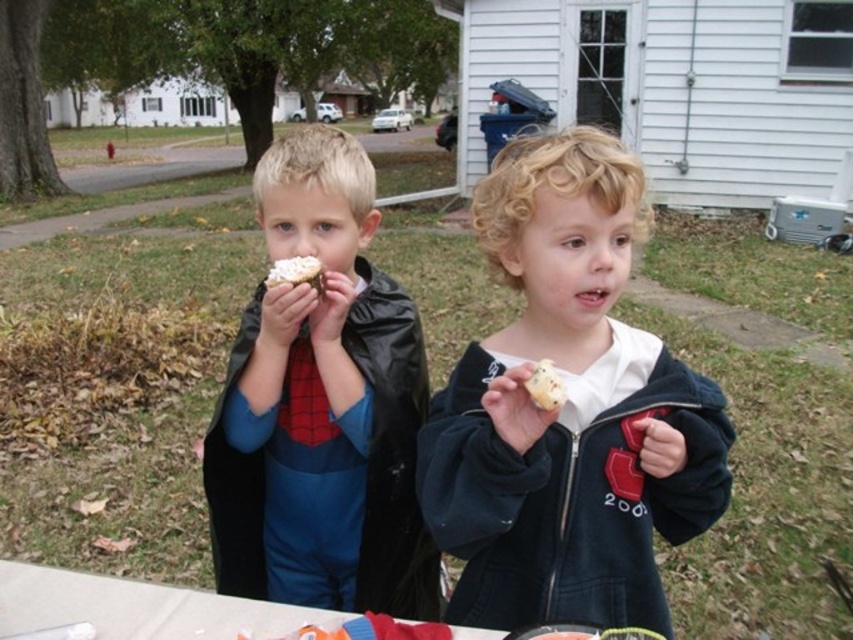
Question: Does white fluffy cake at center have a larger size compared to white fluffy cupcake at center?

Choices:
 (A) yes
 (B) no

Answer: (A)

Question: Which point is farther to the camera?

Choices:
 (A) white plastic table at lower center
 (B) matte black jacket at center

Answer: (A)

Question: Which object appears closest to the camera in this image?

Choices:
 (A) matte black cape at left
 (B) matte black jacket at center
 (C) white plastic table at lower center

Answer: (B)

Question: Can you confirm if white plastic table at lower center is smaller than white fluffy cupcake at center?

Choices:
 (A) no
 (B) yes

Answer: (A)

Question: Does matte black jacket at center have a greater width compared to matte black cape at left?

Choices:
 (A) no
 (B) yes

Answer: (A)

Question: Which point is closer to the camera?

Choices:
 (A) white fluffy cake at center
 (B) white fluffy cupcake at center
 (C) matte black jacket at center

Answer: (B)